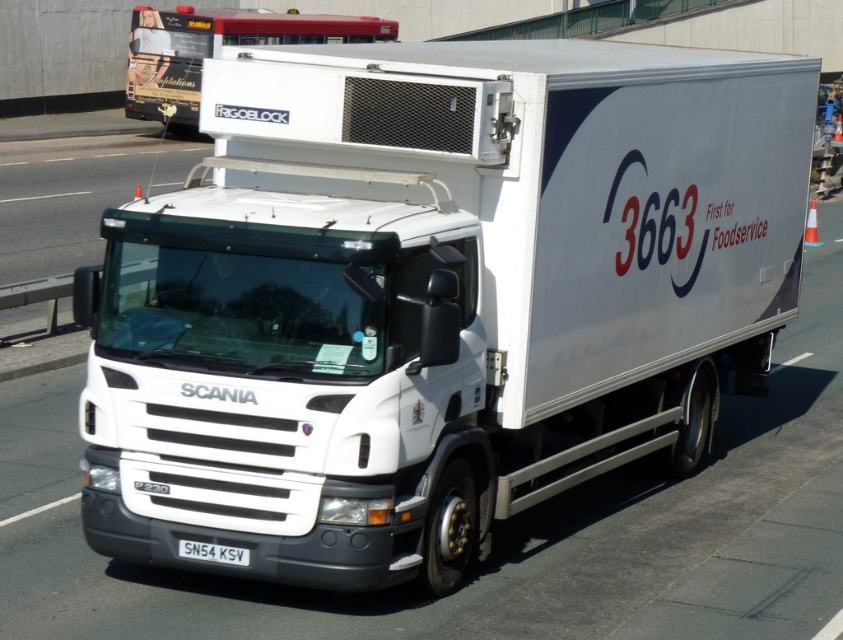
Question: Which point appears closest to the camera in this image?

Choices:
 (A) (207, 550)
 (B) (282, 26)

Answer: (A)

Question: Does white matte truck at upper center have a smaller size compared to white plastic license plate at lower center?

Choices:
 (A) yes
 (B) no

Answer: (B)

Question: Is white matte truck at upper center below white plastic license plate at lower center?

Choices:
 (A) no
 (B) yes

Answer: (A)

Question: Which point appears farthest from the camera in this image?

Choices:
 (A) (315, 13)
 (B) (234, 554)

Answer: (A)

Question: Does white matte truck at upper center appear over white plastic license plate at lower center?

Choices:
 (A) yes
 (B) no

Answer: (A)